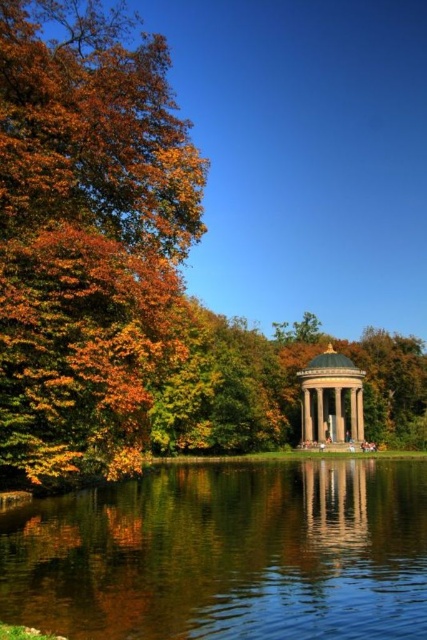
You are standing at the point marked by the coordinate point at the center of the image. You want to walk towards the pavilion located in the background. Will you have to cross the transparent water at center represented by point (227, 554)? Please explain your reasoning based on the scene description.

The transparent water at center represented by point (227, 554) is located at the center of the image. Since the pavilion is in the background and you are standing at the center point, you would need to walk towards the pavilion through the transparent water at center represented by point (227, 554) to reach it.

You are standing on the path near the autumn leaves at left and want to reach the transparent water at center. Which direction should you move to get there?

You should move to the right towards the transparent water at center since the autumn leaves at left is positioned on the left side of transparent water at center.